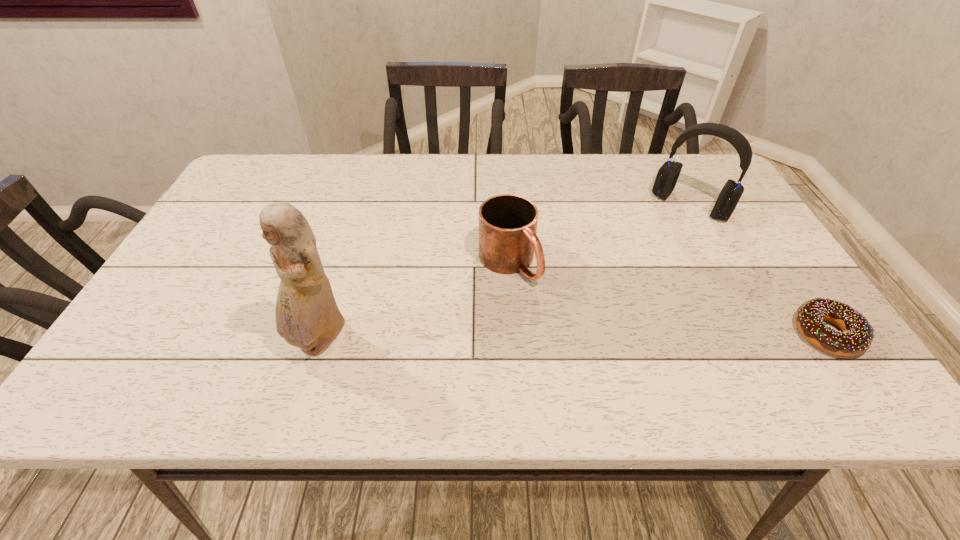
In order to click on vacant space on the desktop that is between the tallest object and the shortest object and is positioned on the headband of the headset in this screenshot , I will do `click(593, 337)`.

This screenshot has width=960, height=540. What are the coordinates of `vacant space on the desktop that is between the leftmost object and the shortest object and is positioned on the side of the mug with the handle` in the screenshot? It's located at (581, 338).